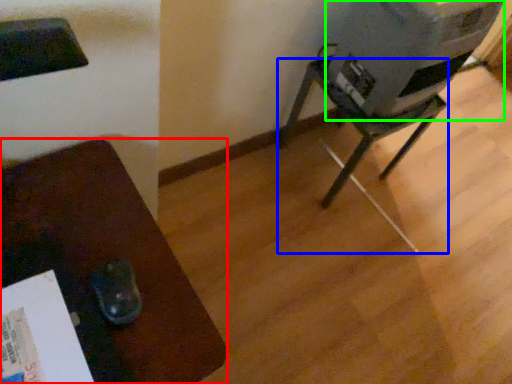
Question: Which object is positioned farthest from furniture (highlighted by a red box)? Select from furniture (highlighted by a blue box) and water cooler (highlighted by a green box).

Choices:
 (A) furniture
 (B) water cooler

Answer: (A)